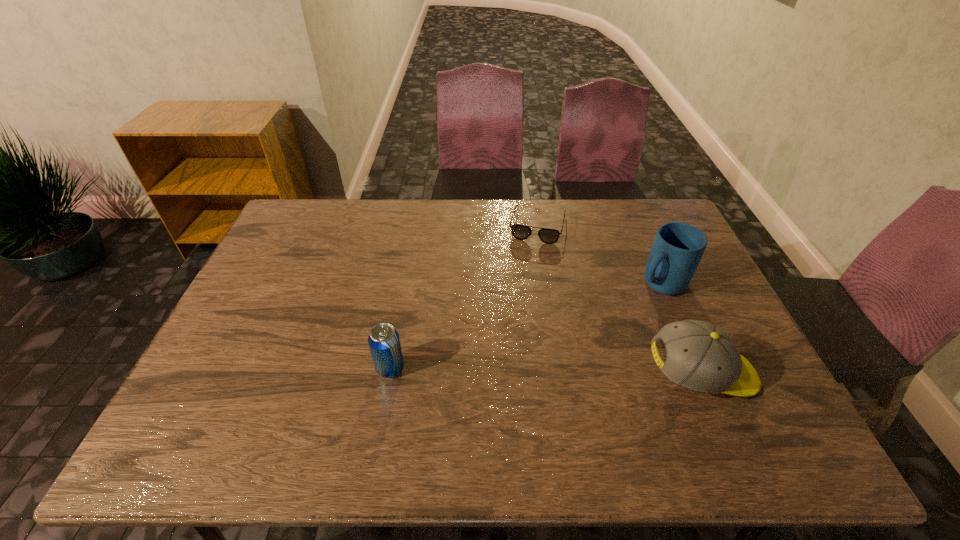
Identify the location of vacant space at the right edge of the desktop. (726, 312).

Where is `blank space at the far right corner of the desktop`? blank space at the far right corner of the desktop is located at coordinates (656, 199).

Identify the location of unoccupied position between the beer can and the baseball cap. The image size is (960, 540). (545, 371).

Where is `unoccupied area between the spectacles and the baseball cap`? This screenshot has height=540, width=960. unoccupied area between the spectacles and the baseball cap is located at coordinates (619, 300).

Identify the location of free space between the farthest object and the baseball cap. (619, 300).

This screenshot has height=540, width=960. I want to click on vacant point located between the spectacles and the baseball cap, so click(x=619, y=300).

This screenshot has width=960, height=540. I want to click on free spot between the leftmost object and the baseball cap, so click(545, 371).

This screenshot has height=540, width=960. Find the location of `empty space between the beer can and the baseball cap`. empty space between the beer can and the baseball cap is located at coordinates (545, 371).

Find the location of a particular element. This screenshot has width=960, height=540. vacant area that lies between the leftmost object and the shortest object is located at coordinates (464, 296).

The width and height of the screenshot is (960, 540). I want to click on vacant area that lies between the beer can and the shortest object, so click(x=464, y=296).